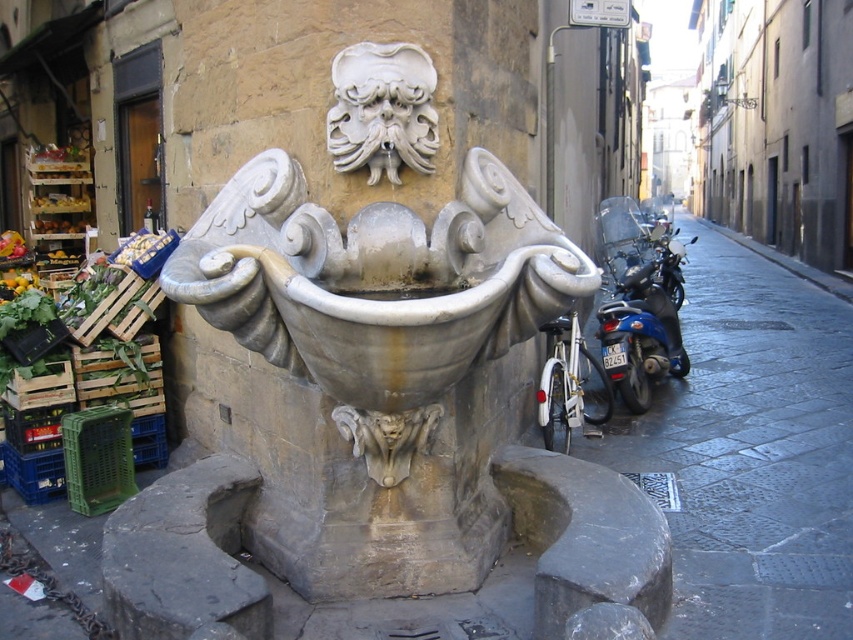
Question: Considering the real-world distances, which object is closest to the stone fountain at center?

Choices:
 (A) blue metallic motorcycle at right
 (B) white stone mask at center
 (C) white matte motorbike at right

Answer: (B)

Question: Does blue metallic motorcycle at right have a larger size compared to white matte motorbike at right?

Choices:
 (A) yes
 (B) no

Answer: (A)

Question: Is stone fountain at center bigger than white stone mask at center?

Choices:
 (A) no
 (B) yes

Answer: (B)

Question: Which point is farther to the camera?

Choices:
 (A) click(x=373, y=243)
 (B) click(x=425, y=68)

Answer: (B)

Question: Is stone fountain at center smaller than white matte motorbike at right?

Choices:
 (A) no
 (B) yes

Answer: (A)

Question: Which object is farther from the camera taking this photo?

Choices:
 (A) white matte motorbike at right
 (B) white stone mask at center
 (C) blue metallic motorcycle at right

Answer: (C)